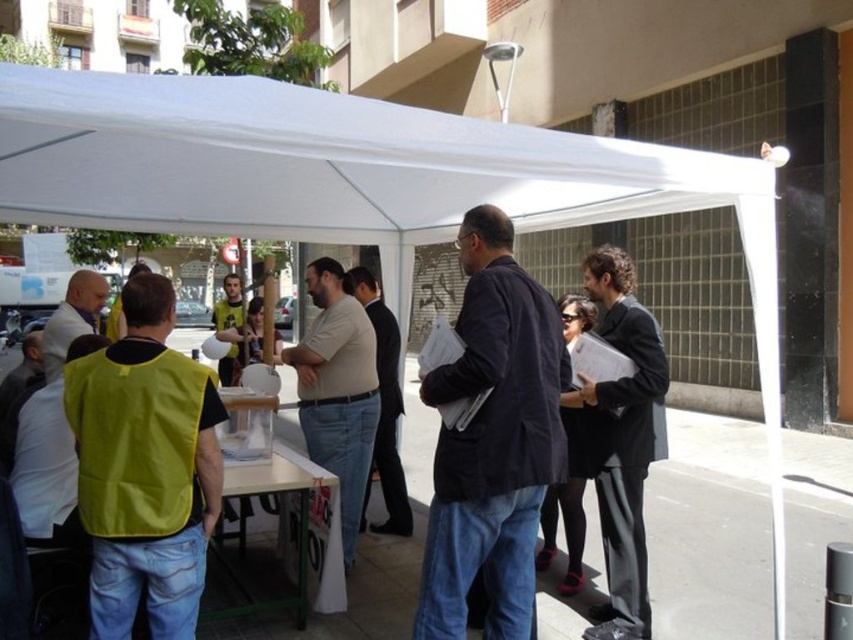
Does point (303, 602) lie behind point (403, 500)?

No, (303, 602) is in front of (403, 500).

Based on the photo, between clear plastic table at center and light brown suit at center, which one has less height?

clear plastic table at center

Locate an element on the screen. This screenshot has width=853, height=640. clear plastic table at center is located at coordinates (293, 518).

Is dark gray suit at center bigger than matte beige shirt at center?

No.

Does dark gray suit at center appear under matte beige shirt at center?

Correct, dark gray suit at center is located below matte beige shirt at center.

Find the location of a particular element. This screenshot has height=640, width=853. dark gray suit at center is located at coordinates (624, 436).

Locate an element on the screen. This screenshot has width=853, height=640. dark gray suit at center is located at coordinates (624, 436).

Who is positioned more to the left, dark gray suit at center or yellow-green vest at center?

yellow-green vest at center

The height and width of the screenshot is (640, 853). I want to click on dark gray suit at center, so click(624, 436).

Image resolution: width=853 pixels, height=640 pixels. Identify the location of dark gray suit at center. (624, 436).